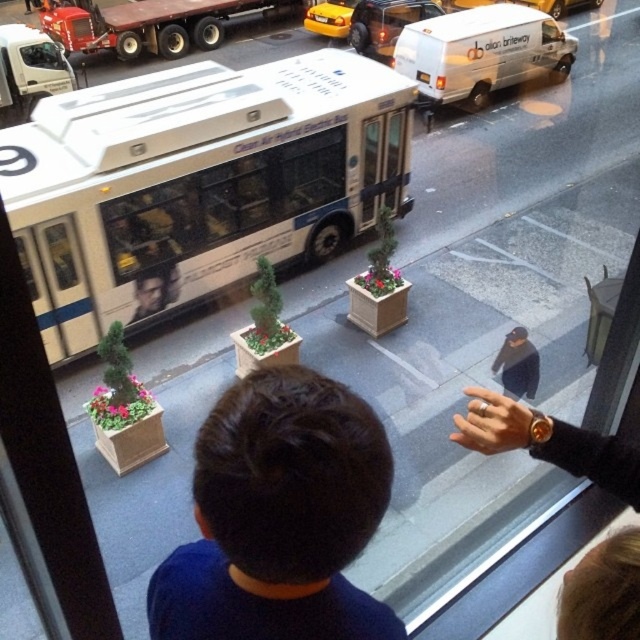
Question: Which object appears closest to the camera in this image?

Choices:
 (A) yellow rubber taxi at upper center
 (B) dark blue shirt at center

Answer: (B)

Question: Can you confirm if brown hair at upper right is smaller than yellow rubber taxi at upper center?

Choices:
 (A) no
 (B) yes

Answer: (B)

Question: Which of these objects is positioned farthest from the white matte bus at center?

Choices:
 (A) gold metallic watch at upper right
 (B) brown hair at upper right
 (C) yellow rubber taxi at upper center

Answer: (C)

Question: Considering the relative positions of dark blue shirt at center and gold metallic watch at upper right in the image provided, where is dark blue shirt at center located with respect to gold metallic watch at upper right?

Choices:
 (A) above
 (B) below

Answer: (B)

Question: Which of the following is the farthest from the observer?

Choices:
 (A) white matte van at upper right
 (B) gold metallic watch at upper right

Answer: (A)

Question: Is white matte van at upper right wider than gold metallic watch at upper right?

Choices:
 (A) no
 (B) yes

Answer: (A)